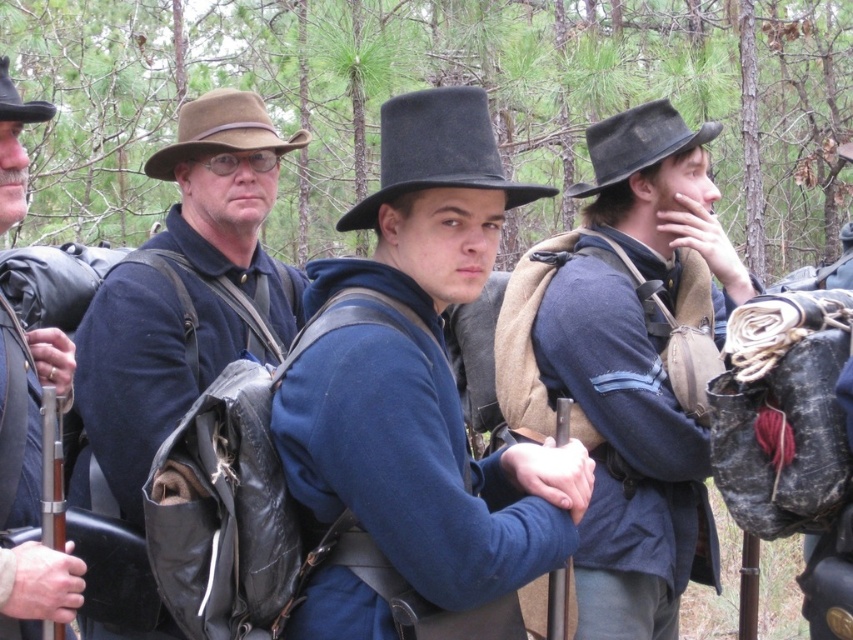
Question: Among these points, which one is farthest from the camera?

Choices:
 (A) (57, 516)
 (B) (357, 420)

Answer: (B)

Question: Among these objects, which one is nearest to the camera?

Choices:
 (A) dark brown felt cowboy hat at upper right
 (B) matte brown hat at center

Answer: (B)

Question: Is matte blue shirt at center to the right of brown felt cowboy hat at upper center from the viewer's perspective?

Choices:
 (A) yes
 (B) no

Answer: (A)

Question: Which object is positioned closest to the matte black rifle at left?

Choices:
 (A) black felt hat at center
 (B) dark brown felt cowboy hat at upper right

Answer: (A)

Question: Does matte brown hat at center have a larger size compared to wooden smooth rifle at left?

Choices:
 (A) yes
 (B) no

Answer: (A)

Question: Is matte brown hat at center bigger than matte black rifle at left?

Choices:
 (A) no
 (B) yes

Answer: (B)